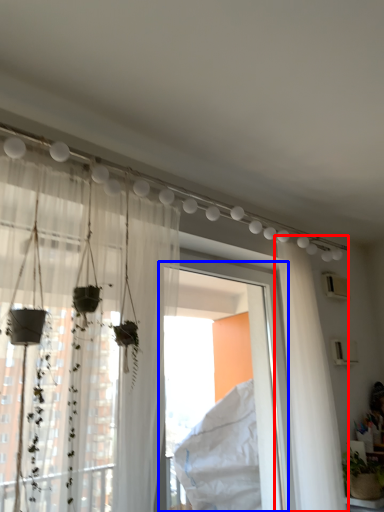
Question: Which object is further to the camera taking this photo, curtain (highlighted by a red box) or window frame (highlighted by a blue box)?

Choices:
 (A) curtain
 (B) window frame

Answer: (A)